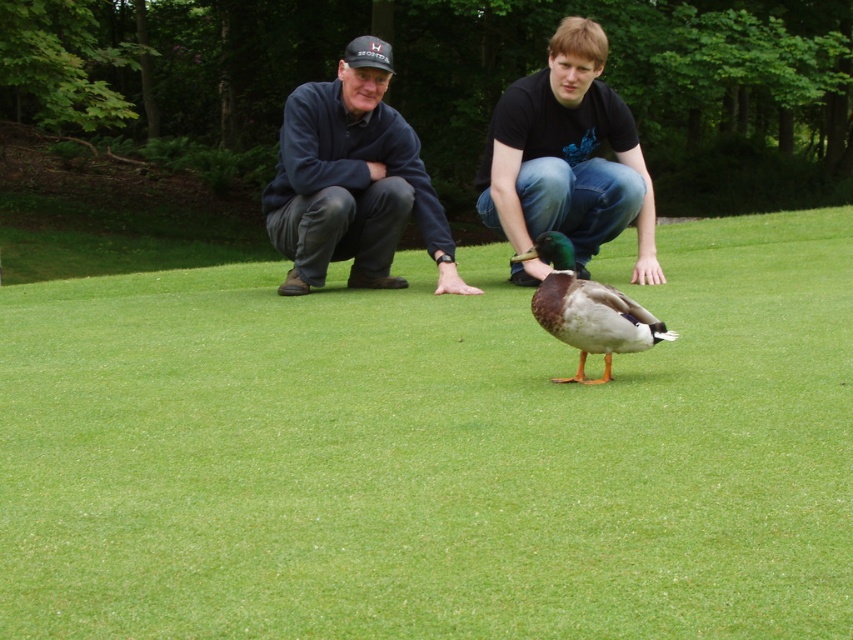
Does green grass at center appear under dark blue fleece at center?

Correct, green grass at center is located below dark blue fleece at center.

Does green grass at center have a lesser width compared to dark blue fleece at center?

Incorrect, green grass at center's width is not less than dark blue fleece at center's.

Describe the element at coordinates (433, 452) in the screenshot. I see `green grass at center` at that location.

Find the location of a particular element. The image size is (853, 640). green grass at center is located at coordinates click(433, 452).

Can you confirm if black cotton t-shirt at center is shorter than green matte duck at center?

No, black cotton t-shirt at center is not shorter than green matte duck at center.

Between black cotton t-shirt at center and green matte duck at center, which one is positioned higher?

black cotton t-shirt at center is above.

Who is more forward, (595, 205) or (608, 364)?

Point (608, 364) is in front.

The image size is (853, 640). I want to click on black cotton t-shirt at center, so point(567,156).

Who is positioned more to the right, green grass at center or green matte duck at center?

green matte duck at center is more to the right.

Who is more forward, (350, 308) or (601, 342)?

Point (601, 342) is more forward.

Between point (328, 602) and point (563, 307), which one is positioned in front?

Point (328, 602) is in front.

The image size is (853, 640). Identify the location of green grass at center. (433, 452).